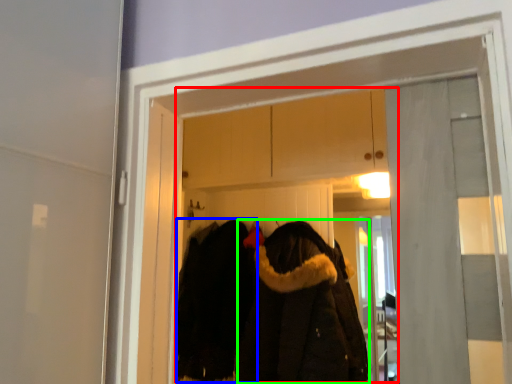
Question: Which is farther away from clothing store (highlighted by a red box)? cloak (highlighted by a blue box) or cloak (highlighted by a green box)?

Choices:
 (A) cloak
 (B) cloak

Answer: (B)